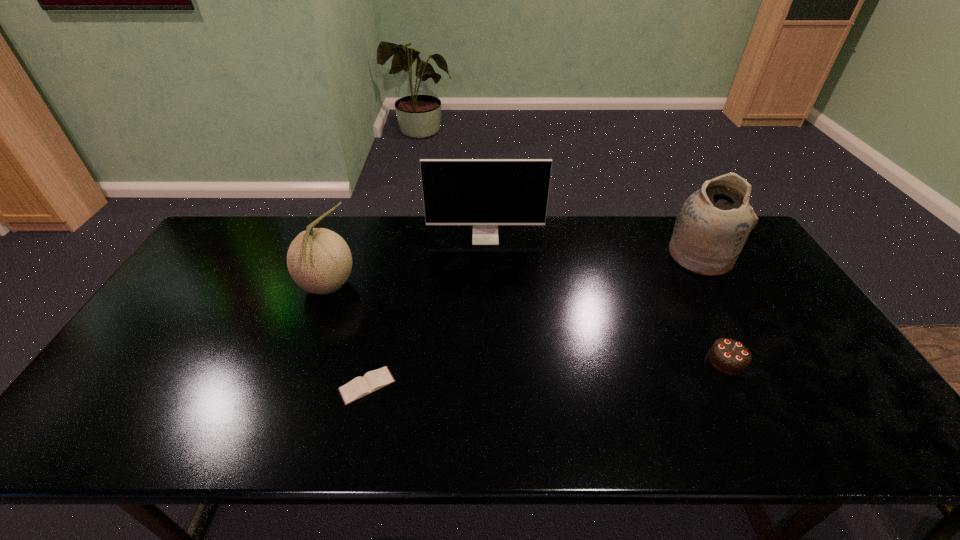
At what (x,y) coordinates should I click in order to perform the action: click on vacant region located 0.220m on the right of the shortest object. Please return your answer as a coordinate pair (x, y). Looking at the image, I should click on (486, 386).

This screenshot has height=540, width=960. Find the location of `monitor that is positioned at the far edge`. monitor that is positioned at the far edge is located at coordinates (485, 193).

Where is `pottery that is at the far edge`? pottery that is at the far edge is located at coordinates click(x=713, y=224).

I want to click on object at the right edge, so click(x=713, y=224).

The height and width of the screenshot is (540, 960). What are the coordinates of `object present at the far right corner` in the screenshot? It's located at (713, 224).

Image resolution: width=960 pixels, height=540 pixels. I want to click on free space at the far edge of the desktop, so click(x=588, y=255).

In the image, there is a desktop. Where is `vacant space at the near edge`? This screenshot has height=540, width=960. vacant space at the near edge is located at coordinates (403, 438).

Where is `vacant space at the left edge`? The width and height of the screenshot is (960, 540). vacant space at the left edge is located at coordinates (215, 259).

In the image, there is a desktop. What are the coordinates of `vacant space at the near right corner` in the screenshot? It's located at (838, 417).

You are a GUI agent. You are given a task and a screenshot of the screen. Output one action in this format:
    pyautogui.click(x=<x>, y=<y>)
    Task: Click on the free space between the cantaloup and the diary
    
    Given the screenshot: What is the action you would take?
    pyautogui.click(x=348, y=336)